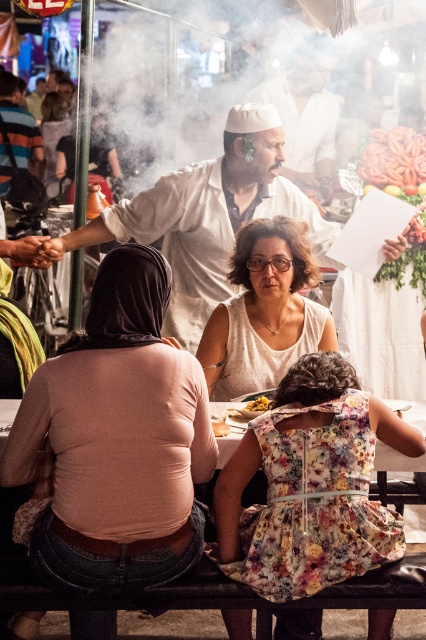
Question: Among these objects, which one is nearest to the camera?

Choices:
 (A) matte white blouse at center
 (B) smooth yellow bread at lower center
 (C) smooth brown sausages at upper right

Answer: (B)

Question: Can you confirm if matte white blouse at center is thinner than golden crispy fries at center?

Choices:
 (A) no
 (B) yes

Answer: (A)

Question: Which object appears farthest from the camera in this image?

Choices:
 (A) golden crispy fries at center
 (B) pale pink fabric at center

Answer: (A)

Question: Can you confirm if white cotton shirt at center is thinner than matte white blouse at center?

Choices:
 (A) no
 (B) yes

Answer: (A)

Question: Considering the real-world distances, which object is farthest from the floral dress at lower center?

Choices:
 (A) white cotton shirt at center
 (B) pale pink fabric at center
 (C) matte white blouse at center
 (D) smooth brown sausages at upper right

Answer: (D)

Question: Is pale pink fabric at center above golden crispy fries at center?

Choices:
 (A) no
 (B) yes

Answer: (B)